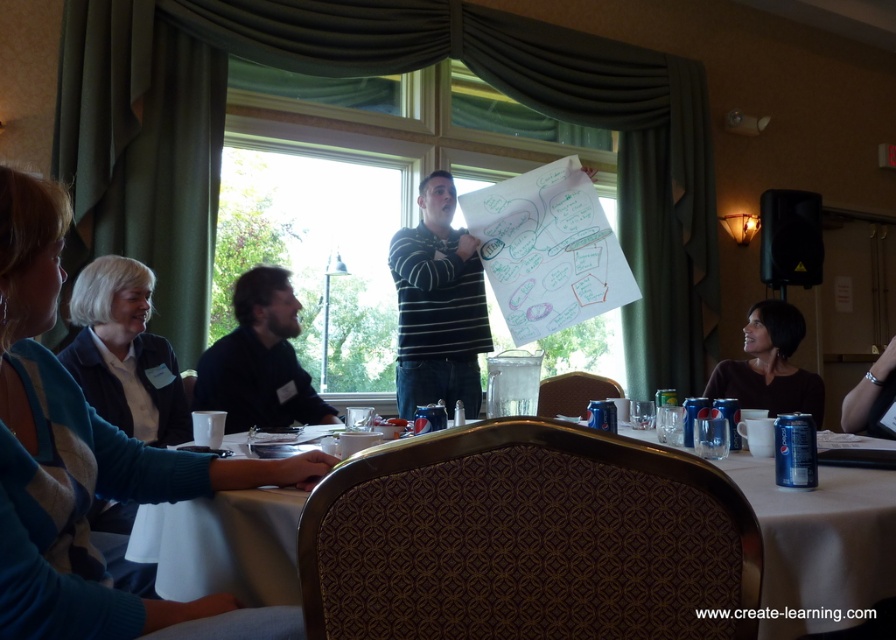
Question: Which of these objects is positioned closest to the white fabric table at lower center?

Choices:
 (A) striped cotton shirt at center
 (B) black hair at upper right
 (C) dark blue sweater at lower left

Answer: (B)

Question: Which of the following is the closest to the observer?

Choices:
 (A) striped cotton shirt at center
 (B) black hair at upper right
 (C) striped sweater at left

Answer: (C)

Question: Is striped sweater at left bigger than dark blue sweater at center?

Choices:
 (A) yes
 (B) no

Answer: (A)

Question: Does white fabric table at lower center lie in front of striped cotton shirt at center?

Choices:
 (A) yes
 (B) no

Answer: (A)

Question: Is white fabric table at lower center positioned at the back of black hair at upper right?

Choices:
 (A) yes
 (B) no

Answer: (B)

Question: Among these points, which one is farthest from the camera?

Choices:
 (A) (427, 218)
 (B) (719, 362)
 (C) (46, 250)

Answer: (A)